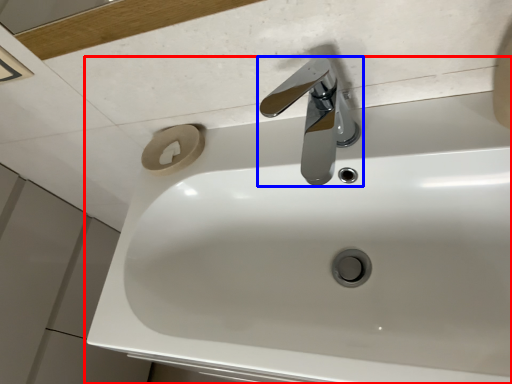
Question: Which point is closer to the camera, sink (highlighted by a red box) or tap (highlighted by a blue box)?

Choices:
 (A) sink
 (B) tap

Answer: (A)